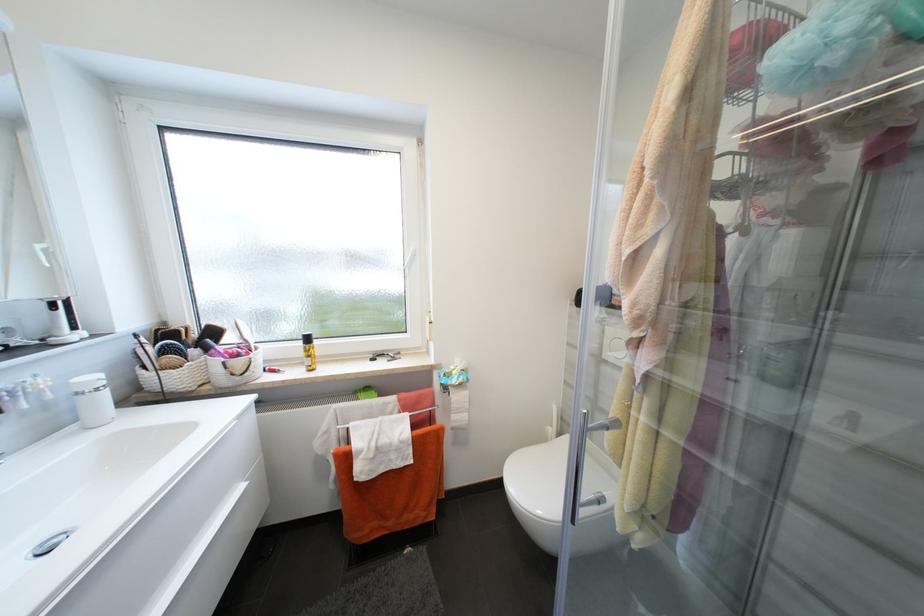
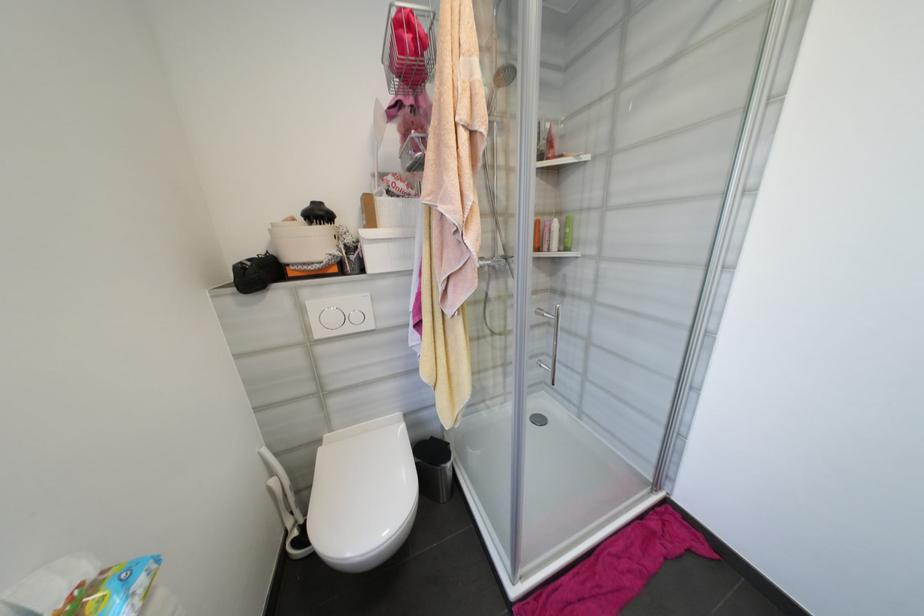
In the second image, find the point that corresponds to (x=554, y=430) in the first image.

(277, 482)